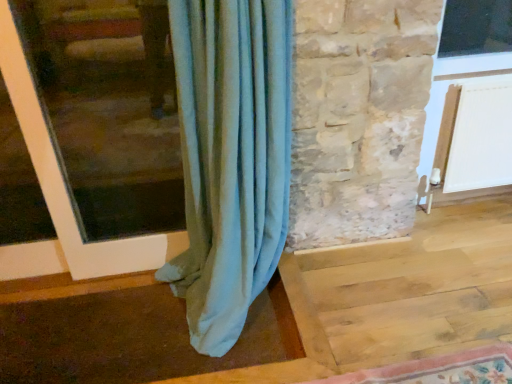
Question: Is matte white window frame at left shorter than rug with floral pattern at lower right?

Choices:
 (A) no
 (B) yes

Answer: (A)

Question: Is matte white window frame at left at the left side of rug with floral pattern at lower right?

Choices:
 (A) no
 (B) yes

Answer: (B)

Question: From a real-world perspective, is matte white window frame at left over rug with floral pattern at lower right?

Choices:
 (A) yes
 (B) no

Answer: (A)

Question: Is matte white window frame at left oriented away from rug with floral pattern at lower right?

Choices:
 (A) no
 (B) yes

Answer: (A)

Question: Can you confirm if matte white window frame at left is bigger than rug with floral pattern at lower right?

Choices:
 (A) yes
 (B) no

Answer: (A)

Question: Is matte white window frame at left facing towards rug with floral pattern at lower right?

Choices:
 (A) no
 (B) yes

Answer: (B)

Question: Does rug with floral pattern at lower right appear on the right side of matte white window frame at left?

Choices:
 (A) yes
 (B) no

Answer: (A)

Question: From the image's perspective, is rug with floral pattern at lower right beneath matte white window frame at left?

Choices:
 (A) yes
 (B) no

Answer: (A)

Question: From a real-world perspective, is rug with floral pattern at lower right positioned over matte white window frame at left based on gravity?

Choices:
 (A) yes
 (B) no

Answer: (B)

Question: Is rug with floral pattern at lower right oriented away from matte white window frame at left?

Choices:
 (A) yes
 (B) no

Answer: (B)

Question: Is rug with floral pattern at lower right in front of matte white window frame at left?

Choices:
 (A) yes
 (B) no

Answer: (A)

Question: From a real-world perspective, is rug with floral pattern at lower right located beneath matte white window frame at left?

Choices:
 (A) yes
 (B) no

Answer: (A)

Question: Can you confirm if white plastic screen door at upper right is positioned to the right of matte white window frame at left?

Choices:
 (A) yes
 (B) no

Answer: (A)